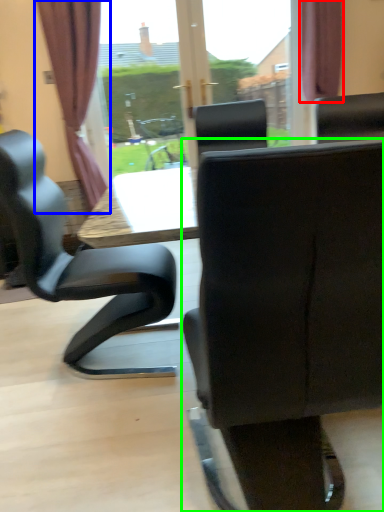
Question: Which object is positioned farthest from curtain (highlighted by a red box)? Select from curtain (highlighted by a blue box) and chair (highlighted by a green box).

Choices:
 (A) curtain
 (B) chair

Answer: (B)